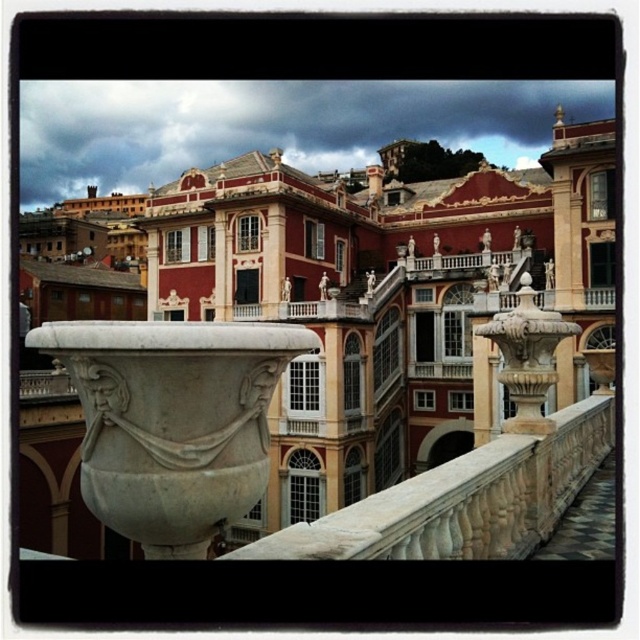
You are standing at the entrance of the matte stone palace at center. If you look towards the north, which direction would the stone railing with the vases be relative to your position?

The stone railing with the vases is in the foreground of the matte stone palace at center, so they are positioned in front of the palace. Since you are at the entrance facing the palace, the railing and vases would be directly in front of you, not to the north. The north direction would be to your left or right depending on the palace orientation, but based on typical architectural layouts, the railing is likely in front, so the vases are not north but ahead.

You are a tour guide leading a group to the entrance of the matte stone palace at center. The entrance is behind the white stone railing at center. If your group is currently standing 30 meters away from the palace, how many more meters do they need to walk to reach the railing?

The distance between the matte stone palace at center and the white stone railing at center is 67.25 meters. Since the group is 30 meters away from the palace, they need to walk an additional 67.25 meters minus 30 meters, totaling 37.25 meters to reach the railing.